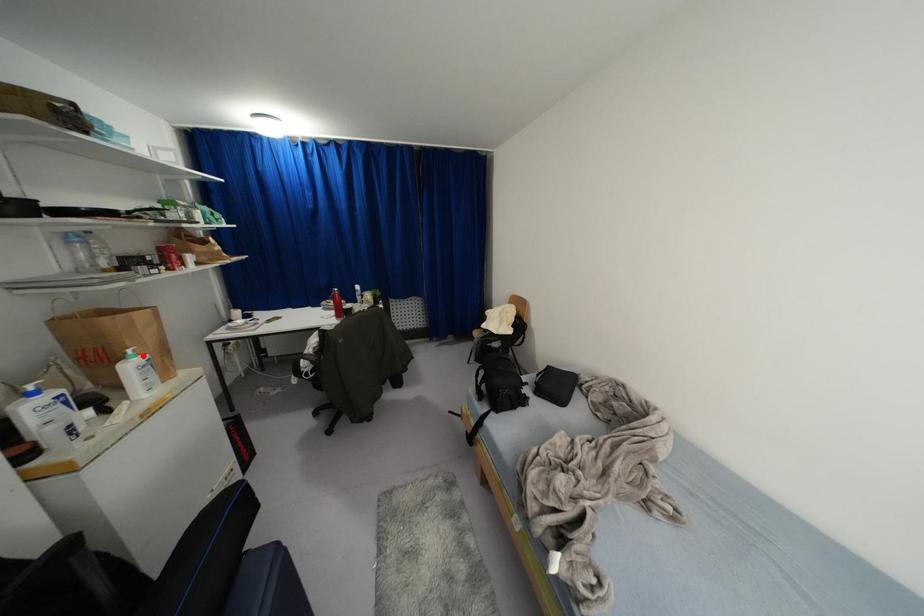
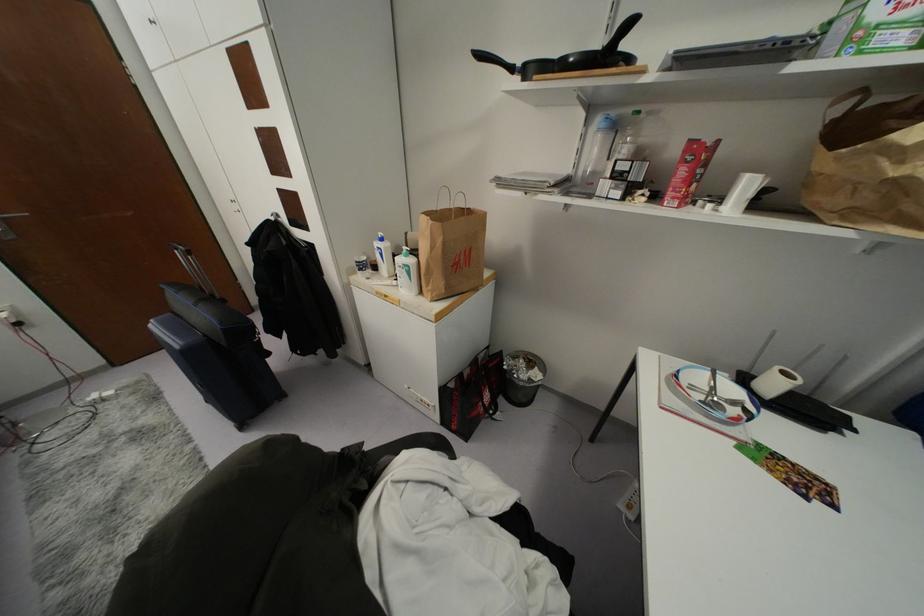
Locate, in the second image, the point that corresponds to the highlighted location in the first image.

(410, 261)